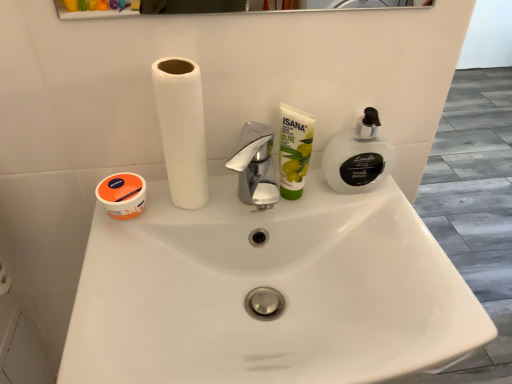
Where is `vacant space to the left of green matte olive oil cream at center`? vacant space to the left of green matte olive oil cream at center is located at coordinates (213, 215).